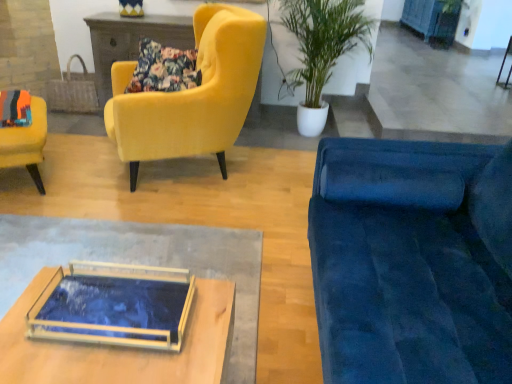
Where is `free space to the back side of translucent glass tray at center`? This screenshot has height=384, width=512. free space to the back side of translucent glass tray at center is located at coordinates (184, 188).